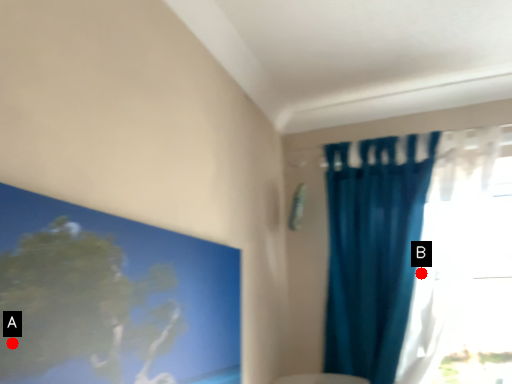
Question: Two points are circled on the image, labeled by A and B beside each circle. Which point is closer to the camera taking this photo?

Choices:
 (A) A is closer
 (B) B is closer

Answer: (A)